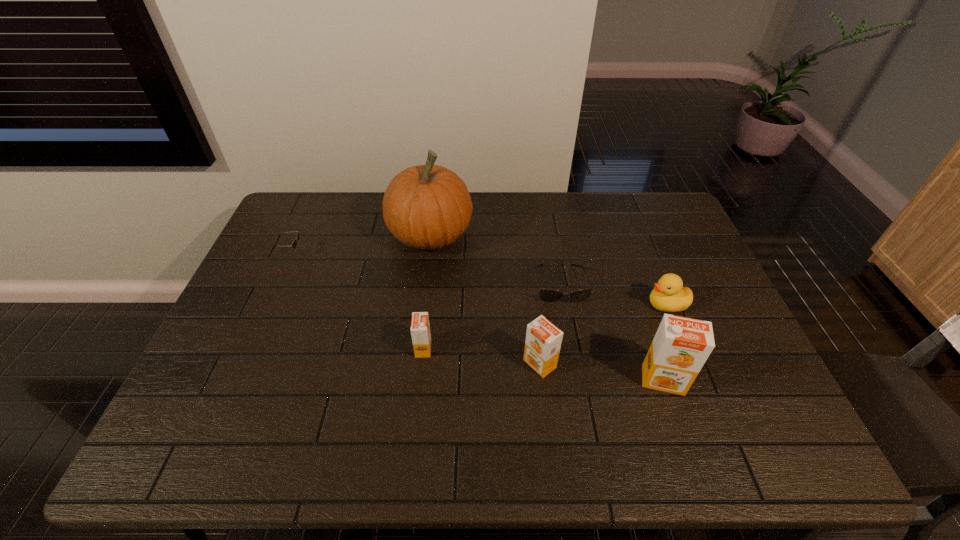
You are a GUI agent. You are given a task and a screenshot of the screen. Output one action in this format:
    pyautogui.click(x=<x>, y=<y>)
    Task: Click on the leftmost orange juice
    The image size is (960, 540).
    Given the screenshot: What is the action you would take?
    pyautogui.click(x=420, y=328)

Where is `the second shortest orange juice`? Image resolution: width=960 pixels, height=540 pixels. the second shortest orange juice is located at coordinates (543, 341).

This screenshot has width=960, height=540. Identify the location of the fifth shortest object. (543, 341).

This screenshot has height=540, width=960. What are the coordinates of `the tallest orange juice` in the screenshot? It's located at (681, 346).

This screenshot has width=960, height=540. I want to click on the second tallest object, so click(x=681, y=346).

Find the location of `the tallest object`. the tallest object is located at coordinates (428, 206).

The image size is (960, 540). In order to click on the sixth tallest object in this screenshot , I will do point(294,244).

Find the location of `the leftmost object`. the leftmost object is located at coordinates (294, 244).

Image resolution: width=960 pixels, height=540 pixels. I want to click on duckling, so click(669, 295).

This screenshot has height=540, width=960. I want to click on the right sunglasses, so click(x=547, y=295).